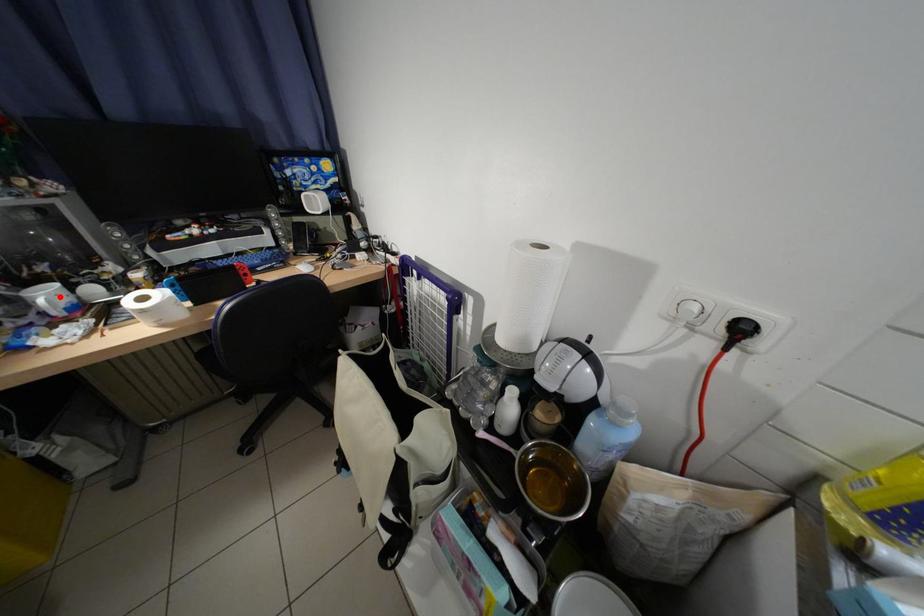
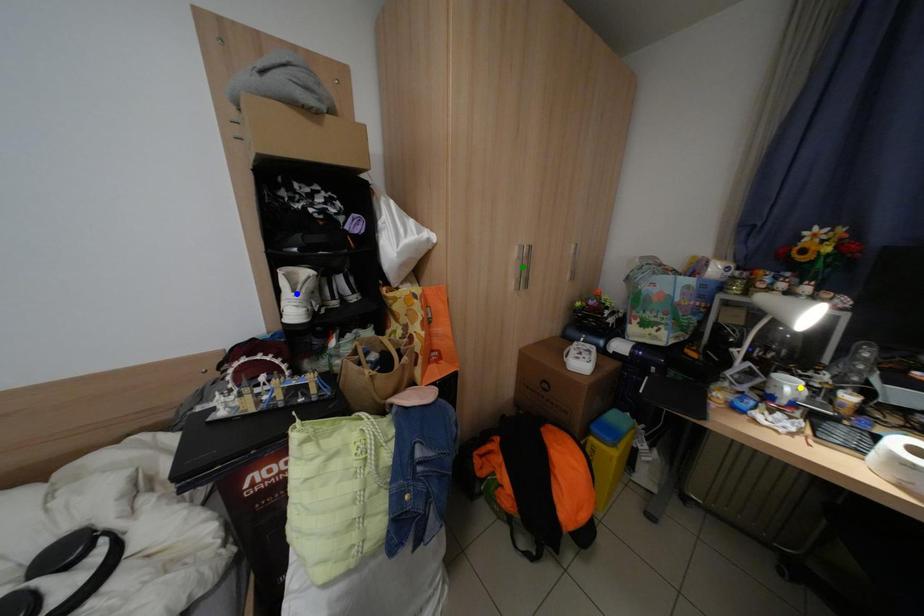
Question: I am providing you with two images of the same scene from different viewpoints. A red point is marked on the first image. You are given multiple points on the second image. Which point in image 2 represents the same 3d spot as the red point in image 1?

Choices:
 (A) yellow point
 (B) blue point
 (C) green point

Answer: (A)